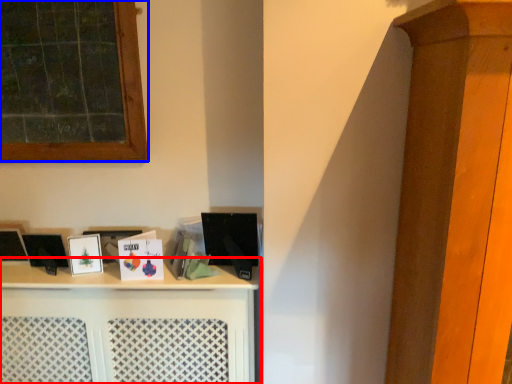
Question: Which object appears farthest to the camera in this image, shelf (highlighted by a red box) or window (highlighted by a blue box)?

Choices:
 (A) shelf
 (B) window

Answer: (A)